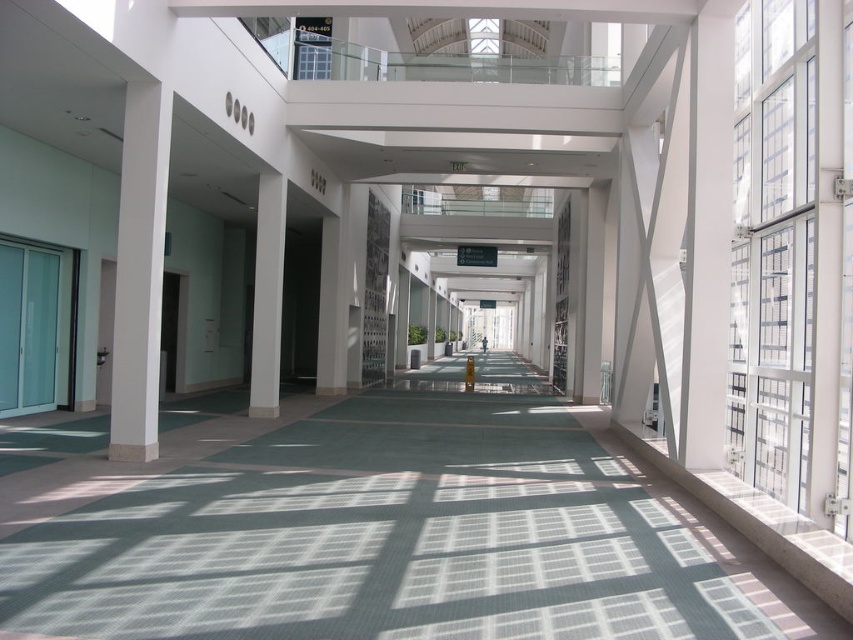
Question: Is green carpet at center positioned before white smooth column at left?

Choices:
 (A) yes
 (B) no

Answer: (A)

Question: Can you confirm if green carpet at center is bigger than white smooth column at left?

Choices:
 (A) yes
 (B) no

Answer: (A)

Question: Does green carpet at center appear on the left side of white glossy column at center?

Choices:
 (A) yes
 (B) no

Answer: (B)

Question: Among these points, which one is farthest from the camera?

Choices:
 (A) (138, 493)
 (B) (154, 420)
 (C) (256, 301)

Answer: (C)

Question: Which object is positioned closest to the white smooth column at left?

Choices:
 (A) white glossy column at center
 (B) green carpet at center

Answer: (B)

Question: Which object is positioned closest to the green carpet at center?

Choices:
 (A) white glossy column at center
 (B) white smooth column at left

Answer: (B)